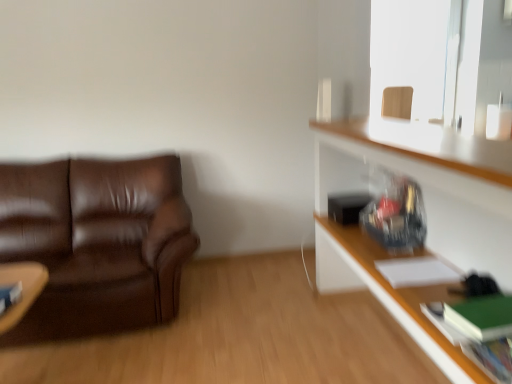
Question: From a real-world perspective, relative to green matte book at lower right, the second book when ordered from right to left, is hardcover book at lower right, placed as the 1th book when sorted from front to back, vertically above or below?

Choices:
 (A) above
 (B) below

Answer: (A)

Question: Is point (501, 340) positioned closer to the camera than point (450, 304)?

Choices:
 (A) farther
 (B) closer

Answer: (B)

Question: Which object is the farthest from the wooden frame at upper right?

Choices:
 (A) wooden swivel chair at upper right
 (B) hardcover book at lower left, the fourth book from the right
 (C) green matte book at lower right, which appears as the 3th book when viewed from the left
 (D) white paper at upper right, acting as the third book starting from the right
 (E) hardcover book at lower right, placed as the 1th book when sorted from front to back

Answer: (B)

Question: Which object is the farthest from the hardcover book at lower right, the 4th book from the back?

Choices:
 (A) wooden frame at upper right
 (B) green matte book at lower right, which is counted as the 3th book, starting from the back
 (C) wooden swivel chair at upper right
 (D) wooden shelf at right
 (E) brown leather couch at left

Answer: (A)